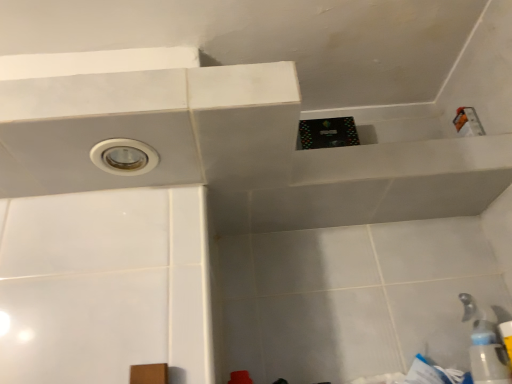
The width and height of the screenshot is (512, 384). In order to click on white plastic hole at upper left in this screenshot , I will do `click(124, 157)`.

In order to click on transparent plastic bottle at lower right in this screenshot , I will do `click(488, 359)`.

At what (x,y) coordinates should I click in order to perform the action: click on white plastic faucet at lower right. Please return your answer as a coordinate pair (x, y). This screenshot has width=512, height=384. Looking at the image, I should click on (485, 344).

Is point (111, 154) less distant than point (473, 355)?

Yes, point (111, 154) is in front of point (473, 355).

Which object is positioned more to the right, white plastic hole at upper left or transparent plastic bottle at lower right?

From the viewer's perspective, transparent plastic bottle at lower right appears more on the right side.

Is white plastic hole at upper left far from transparent plastic bottle at lower right?

That's not correct — white plastic hole at upper left is a little close to transparent plastic bottle at lower right.

Is white plastic hole at upper left in front of transparent plastic bottle at lower right?

Yes, it is in front of transparent plastic bottle at lower right.

From a real-world perspective, who is located lower, white plastic hole at upper left or white plastic faucet at lower right?

In real-world perspective, white plastic faucet at lower right is lower.

Is white plastic faucet at lower right surrounded by white plastic hole at upper left?

No, white plastic hole at upper left does not contain white plastic faucet at lower right.

From the image's perspective, is white plastic hole at upper left above or below white plastic faucet at lower right?

white plastic hole at upper left is above white plastic faucet at lower right.

Considering the sizes of objects white plastic hole at upper left and white plastic faucet at lower right in the image provided, who is taller, white plastic hole at upper left or white plastic faucet at lower right?

Standing taller between the two is white plastic faucet at lower right.

Find the location of a particular element. plumbing fixture behind the transparent plastic bottle at lower right is located at coordinates (485, 344).

Is point (489, 332) farther from viewer compared to point (478, 316)?

No, (489, 332) is closer to viewer.

From a real-world perspective, who is located higher, transparent plastic bottle at lower right or white plastic faucet at lower right?

From a 3D spatial view, white plastic faucet at lower right is above.

Does transparent plastic bottle at lower right contain white plastic faucet at lower right?

No, white plastic faucet at lower right is not inside transparent plastic bottle at lower right.

In the scene shown: Does white plastic faucet at lower right turn towards transparent plastic bottle at lower right?

No.

Does white plastic faucet at lower right appear on the right side of transparent plastic bottle at lower right?

Yes.

Is white plastic faucet at lower right with transparent plastic bottle at lower right?

Yes, white plastic faucet at lower right is next to transparent plastic bottle at lower right.

Is white plastic faucet at lower right inside or outside of transparent plastic bottle at lower right?

white plastic faucet at lower right is outside transparent plastic bottle at lower right.

Relative to white plastic hole at upper left, is white plastic faucet at lower right in front or behind?

white plastic faucet at lower right is positioned farther from the viewer than white plastic hole at upper left.

Which is closer, (492, 349) or (117, 146)?

Point (492, 349).

From the image's perspective, relative to white plastic hole at upper left, is white plastic faucet at lower right above or below?

Based on their image positions, white plastic faucet at lower right is located beneath white plastic hole at upper left.

What's the angular difference between white plastic faucet at lower right and white plastic hole at upper left's facing directions?

white plastic faucet at lower right and white plastic hole at upper left are facing 0.00261 degrees away from each other.

Is transparent plastic bottle at lower right situated inside white plastic hole at upper left or outside?

transparent plastic bottle at lower right is located beyond the bounds of white plastic hole at upper left.

From a real-world perspective, is transparent plastic bottle at lower right physically below white plastic hole at upper left?

Yes, from a real-world perspective, transparent plastic bottle at lower right is below white plastic hole at upper left.

In the scene shown: Does transparent plastic bottle at lower right have a lesser width compared to white plastic hole at upper left?

Correct, the width of transparent plastic bottle at lower right is less than that of white plastic hole at upper left.

Is point (492, 377) positioned in front of point (105, 145)?

No, it is behind (105, 145).

At what (x,y) coordinates should I click in order to perform the action: click on hole above the transparent plastic bottle at lower right (from the image's perspective). Please return your answer as a coordinate pair (x, y). The width and height of the screenshot is (512, 384). Looking at the image, I should click on (124, 157).

The height and width of the screenshot is (384, 512). In order to click on plumbing fixture lying below the white plastic hole at upper left (from the image's perspective) in this screenshot , I will do [485, 344].

Looking at this image, looking at the image, which one is located further to white plastic faucet at lower right, transparent plastic bottle at lower right or white plastic hole at upper left?

white plastic hole at upper left is further to white plastic faucet at lower right.

Considering their positions, is white plastic hole at upper left positioned further to transparent plastic bottle at lower right than white plastic faucet at lower right?

white plastic hole at upper left.

Looking at the image, which one is located closer to white plastic hole at upper left, transparent plastic bottle at lower right or white plastic faucet at lower right?

Among the two, transparent plastic bottle at lower right is located nearer to white plastic hole at upper left.

From the image, which object appears to be farther from white plastic faucet at lower right, white plastic hole at upper left or transparent plastic bottle at lower right?

Based on the image, white plastic hole at upper left appears to be further to white plastic faucet at lower right.

From the image, which object appears to be farther from transparent plastic bottle at lower right, white plastic faucet at lower right or white plastic hole at upper left?

Among the two, white plastic hole at upper left is located further to transparent plastic bottle at lower right.

When comparing their distances from white plastic hole at upper left, does white plastic faucet at lower right or transparent plastic bottle at lower right seem further?

Based on the image, white plastic faucet at lower right appears to be further to white plastic hole at upper left.

I want to click on bottle situated between white plastic hole at upper left and white plastic faucet at lower right from left to right, so click(x=488, y=359).